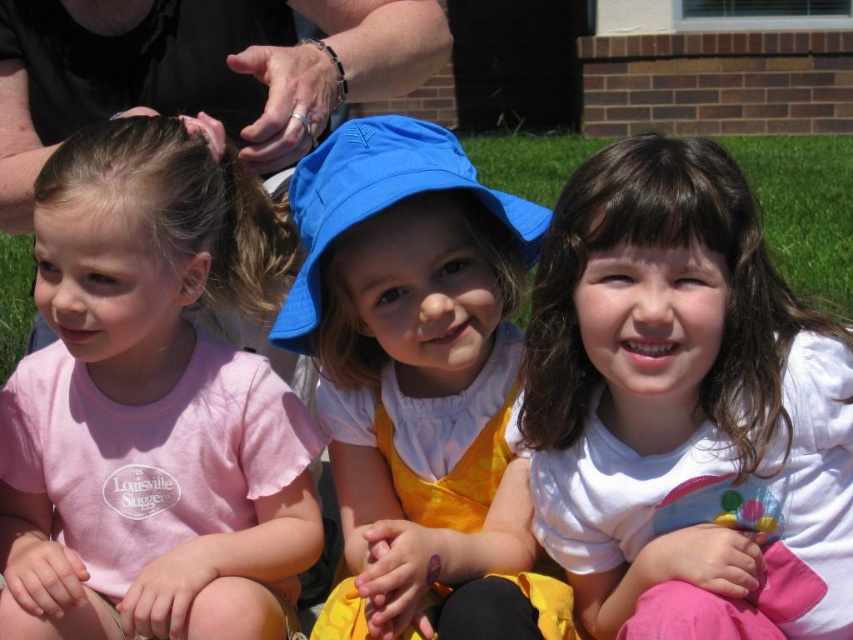
Question: Which object is farther from the camera taking this photo?

Choices:
 (A) blue fabric hat at center
 (B) matte blue sunhat at center
 (C) white matte shirt at center
 (D) pink cotton shirt at left

Answer: (D)

Question: Which object is the closest to the pink cotton shirt at left?

Choices:
 (A) white matte shirt at center
 (B) blue fabric hat at center

Answer: (B)

Question: Does white matte shirt at center come behind blue fabric hat at center?

Choices:
 (A) no
 (B) yes

Answer: (A)

Question: Does matte blue sunhat at center have a greater width compared to blue fabric hat at center?

Choices:
 (A) yes
 (B) no

Answer: (A)

Question: Is white matte shirt at center bigger than matte blue sunhat at center?

Choices:
 (A) yes
 (B) no

Answer: (B)

Question: Among these points, which one is farthest from the camera?

Choices:
 (A) (364, 179)
 (B) (293, 602)

Answer: (B)